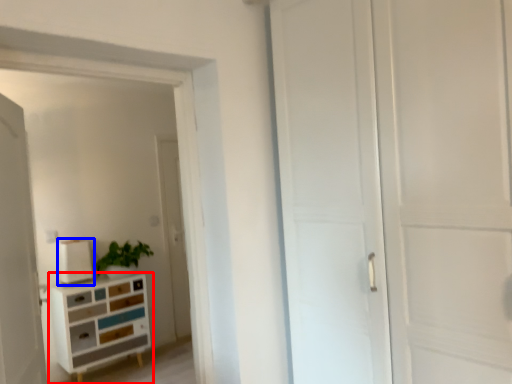
Question: Which object appears closest to the camera in this image, chest of drawers (highlighted by a red box) or appliance (highlighted by a blue box)?

Choices:
 (A) chest of drawers
 (B) appliance

Answer: (A)